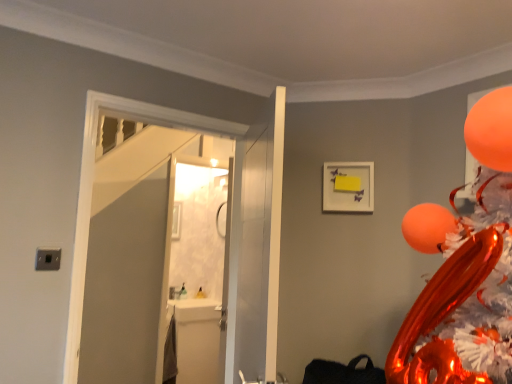
Find the location of a particular element. white glossy door at center, the second door when ordered from right to left is located at coordinates (251, 256).

What are the coordinates of `orange glossy balloon at upper right` in the screenshot? It's located at (490, 130).

What do you see at coordinates (193, 341) in the screenshot? This screenshot has width=512, height=384. I see `white glossy sink at lower left` at bounding box center [193, 341].

At what (x,y) coordinates should I click in order to perform the action: click on white glossy door at center, which is the 1th door from left to right. Please return your answer as a coordinate pair (x, y). Looking at the image, I should click on (251, 256).

From a real-world perspective, is white glossy door at center, the second door when ordered from right to left, physically above white glossy door at center, the 1th door in the right-to-left sequence?

Yes, from a real-world perspective, white glossy door at center, the second door when ordered from right to left, is above white glossy door at center, the 1th door in the right-to-left sequence.

Is point (90, 243) positioned after point (272, 158)?

Yes, point (90, 243) is behind point (272, 158).

Is white glossy door at center, the second door when ordered from right to left, positioned far away from white glossy door at center, the 1th door in the right-to-left sequence?

white glossy door at center, the second door when ordered from right to left, is near white glossy door at center, the 1th door in the right-to-left sequence, not far away.

How many degrees apart are the facing directions of white glossy door at center, which is the 1th door from left to right, and white glossy door at center, the 1th door in the right-to-left sequence?

114 degrees separate the facing orientations of white glossy door at center, which is the 1th door from left to right, and white glossy door at center, the 1th door in the right-to-left sequence.

Would you say white matte picture frame at upper center is a long distance from white glossy door at center, the second door when ordered from right to left?

They are positioned close to each other.

Between white matte picture frame at upper center and white glossy door at center, which is the 1th door from left to right, which one has less height?

white matte picture frame at upper center.

Locate an element on the screen. This screenshot has height=384, width=512. balloon lying in front of the white matte picture frame at upper center is located at coordinates (490, 130).

Considering their positions, is orange glossy balloon at upper right located in front of or behind white matte picture frame at upper center?

orange glossy balloon at upper right is in front of white matte picture frame at upper center.

Based on the photo, from the image's perspective, would you say orange glossy balloon at upper right is positioned over white matte picture frame at upper center?

A: Yes, from the image's perspective, orange glossy balloon at upper right is on top of white matte picture frame at upper center.

Is white glossy door at center, the 2th door when ordered from left to right, in front of or behind orange glossy balloon at upper right in the image?

In the image, white glossy door at center, the 2th door when ordered from left to right, appears in front of orange glossy balloon at upper right.

Which object is positioned more to the right, white glossy door at center, the 1th door in the right-to-left sequence, or orange glossy balloon at upper right?

orange glossy balloon at upper right.

Is white glossy door at center, the 2th door when ordered from left to right, positioned beyond the bounds of white matte picture frame at upper center?

Indeed, white glossy door at center, the 2th door when ordered from left to right, is completely outside white matte picture frame at upper center.

Does point (232, 247) lie behind point (362, 210)?

Yes.

From the image's perspective, would you say white glossy door at center, the 1th door in the right-to-left sequence, is positioned over white matte picture frame at upper center?

No, from the image's perspective, white glossy door at center, the 1th door in the right-to-left sequence, is not over white matte picture frame at upper center.

Where is `sink located on the left of white glossy door at center, the 2th door when ordered from left to right`? The height and width of the screenshot is (384, 512). sink located on the left of white glossy door at center, the 2th door when ordered from left to right is located at coordinates (193, 341).

Considering the relative sizes of white glossy sink at lower left and white glossy door at center, the 1th door in the right-to-left sequence, in the image provided, is white glossy sink at lower left bigger than white glossy door at center, the 1th door in the right-to-left sequence,?

No, white glossy sink at lower left is not bigger than white glossy door at center, the 1th door in the right-to-left sequence.

Between white glossy sink at lower left and white glossy door at center, the 2th door when ordered from left to right, which one is positioned in front?

white glossy door at center, the 2th door when ordered from left to right, is closer to the camera.

In terms of height, does white glossy sink at lower left look taller or shorter compared to white glossy door at center, the 1th door in the right-to-left sequence?

Considering their sizes, white glossy sink at lower left has less height than white glossy door at center, the 1th door in the right-to-left sequence.

Considering the sizes of objects orange glossy balloon at upper right and white glossy door at center, the 1th door in the right-to-left sequence, in the image provided, who is smaller, orange glossy balloon at upper right or white glossy door at center, the 1th door in the right-to-left sequence,?

Smaller between the two is orange glossy balloon at upper right.

Is orange glossy balloon at upper right not near white glossy door at center, the 1th door in the right-to-left sequence?

No, orange glossy balloon at upper right is in close proximity to white glossy door at center, the 1th door in the right-to-left sequence.

Would you say orange glossy balloon at upper right is inside or outside white glossy door at center, the 2th door when ordered from left to right?

orange glossy balloon at upper right cannot be found inside white glossy door at center, the 2th door when ordered from left to right.

Looking at this image, can you confirm if orange glossy balloon at upper right is wider than white glossy door at center, the 1th door in the right-to-left sequence?

Incorrect, the width of orange glossy balloon at upper right does not surpass that of white glossy door at center, the 1th door in the right-to-left sequence.

You are a GUI agent. You are given a task and a screenshot of the screen. Output one action in this format:
    pyautogui.click(x=<x>, y=<y>)
    Task: Click on the door above the white glossy door at center, the 2th door when ordered from left to right (from a real-world perspective)
    Image resolution: width=512 pixels, height=384 pixels.
    Given the screenshot: What is the action you would take?
    [x=251, y=256]

The height and width of the screenshot is (384, 512). In order to click on door that is the 1st one below the white matte picture frame at upper center (from a real-world perspective) in this screenshot , I will do `click(251, 256)`.

Which object lies nearer to the anchor point white glossy door at center, the second door when ordered from right to left, white matte picture frame at upper center or orange glossy balloon at upper right?

white matte picture frame at upper center is positioned closer to the anchor white glossy door at center, the second door when ordered from right to left.

Considering their positions, is white glossy door at center, the 1th door in the right-to-left sequence, positioned further to white glossy sink at lower left than orange glossy balloon at upper right?

orange glossy balloon at upper right.

When comparing their distances from orange glossy balloon at upper right, does white glossy door at center, which is the 1th door from left to right, or white glossy door at center, the 1th door in the right-to-left sequence, seem further?

white glossy door at center, the 1th door in the right-to-left sequence, lies further to orange glossy balloon at upper right than the other object.

From the image, which object appears to be farther from white glossy door at center, which is the 1th door from left to right, white glossy door at center, the 2th door when ordered from left to right, or orange glossy balloon at upper right?

The object further to white glossy door at center, which is the 1th door from left to right, is orange glossy balloon at upper right.

From the image, which object appears to be farther from white matte picture frame at upper center, white glossy door at center, the 1th door in the right-to-left sequence, or white glossy door at center, which is the 1th door from left to right?

The object further to white matte picture frame at upper center is white glossy door at center, the 1th door in the right-to-left sequence.

Looking at this image, estimate the real-world distances between objects in this image. Which object is closer to orange glossy balloon at upper right, white glossy sink at lower left or white glossy door at center, which is the 1th door from left to right?

white glossy door at center, which is the 1th door from left to right.

Looking at the image, which one is located closer to white matte picture frame at upper center, white glossy door at center, the 2th door when ordered from left to right, or orange glossy balloon at upper right?

The object closer to white matte picture frame at upper center is white glossy door at center, the 2th door when ordered from left to right.

Based on their spatial positions, is white glossy door at center, the second door when ordered from right to left, or orange glossy balloon at upper right further from white matte picture frame at upper center?

The object further to white matte picture frame at upper center is orange glossy balloon at upper right.

Where is `picture frame between white glossy door at center, which is the 1th door from left to right, and white glossy sink at lower left from front to back`? This screenshot has width=512, height=384. picture frame between white glossy door at center, which is the 1th door from left to right, and white glossy sink at lower left from front to back is located at coordinates (348, 187).

The width and height of the screenshot is (512, 384). What are the coordinates of `door positioned between white glossy door at center, the 1th door in the right-to-left sequence, and white matte picture frame at upper center from near to far` in the screenshot? It's located at (251, 256).

You are a GUI agent. You are given a task and a screenshot of the screen. Output one action in this format:
    pyautogui.click(x=<x>, y=<y>)
    Task: Click on the picture frame between orange glossy balloon at upper right and white glossy sink at lower left from front to back
    This screenshot has height=384, width=512.
    Given the screenshot: What is the action you would take?
    pyautogui.click(x=348, y=187)

The image size is (512, 384). Identify the location of balloon located between white glossy door at center, which is the 1th door from left to right, and white glossy sink at lower left in the depth direction. (490, 130).